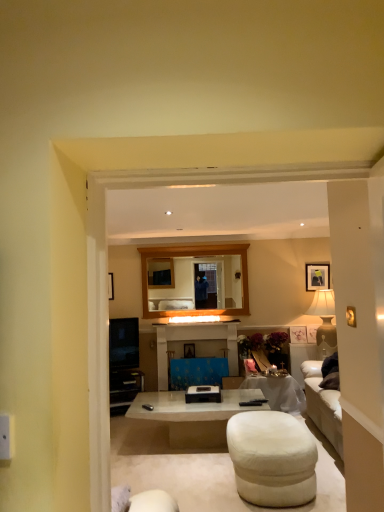
Question: Is wooden-framed mirror at center wider or thinner than blue fabric-covered entertainment center at center?

Choices:
 (A) thin
 (B) wide

Answer: (A)

Question: From a real-world perspective, is wooden-framed mirror at center physically located above or below blue fabric-covered entertainment center at center?

Choices:
 (A) above
 (B) below

Answer: (A)

Question: Estimate the real-world distances between objects in this image. Which object is farther from the white fabric ottoman at lower center?

Choices:
 (A) white glossy coffee table at center
 (B) white glossy table at center
 (C) wooden-framed mirror at center
 (D) blue fabric-covered entertainment center at center

Answer: (C)

Question: Based on their relative distances, which object is farther from the blue fabric-covered entertainment center at center?

Choices:
 (A) white glossy coffee table at center
 (B) white glossy table at center
 (C) white fabric ottoman at lower center
 (D) wooden-framed mirror at center

Answer: (C)